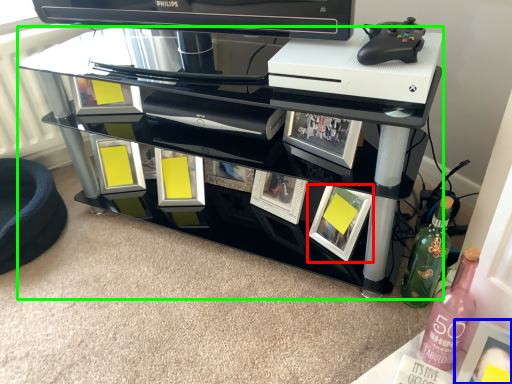
Question: Which object is positioned closest to picture frame (highlighted by a red box)? Select from picture frame (highlighted by a blue box) and table (highlighted by a green box).

Choices:
 (A) picture frame
 (B) table

Answer: (B)